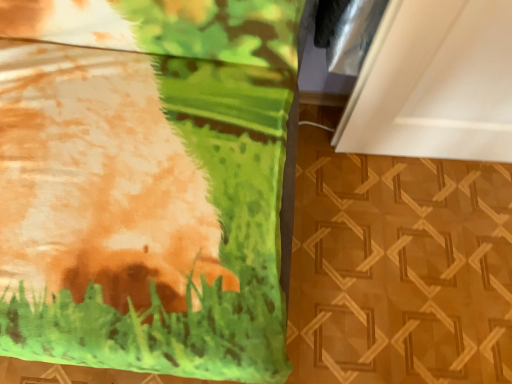
What is the approximate height of matte green blanket at upper left?

matte green blanket at upper left is 30.06 inches in height.

At what (x,y) coordinates should I click in order to perform the action: click on matte green blanket at upper left. Please return your answer as a coordinate pair (x, y). This screenshot has width=512, height=384. Looking at the image, I should click on (98, 180).

The image size is (512, 384). What do you see at coordinates (98, 180) in the screenshot?
I see `matte green blanket at upper left` at bounding box center [98, 180].

At what (x,y) coordinates should I click in order to perform the action: click on matte green blanket at upper left. Please return your answer as a coordinate pair (x, y). The width and height of the screenshot is (512, 384). Looking at the image, I should click on (98, 180).